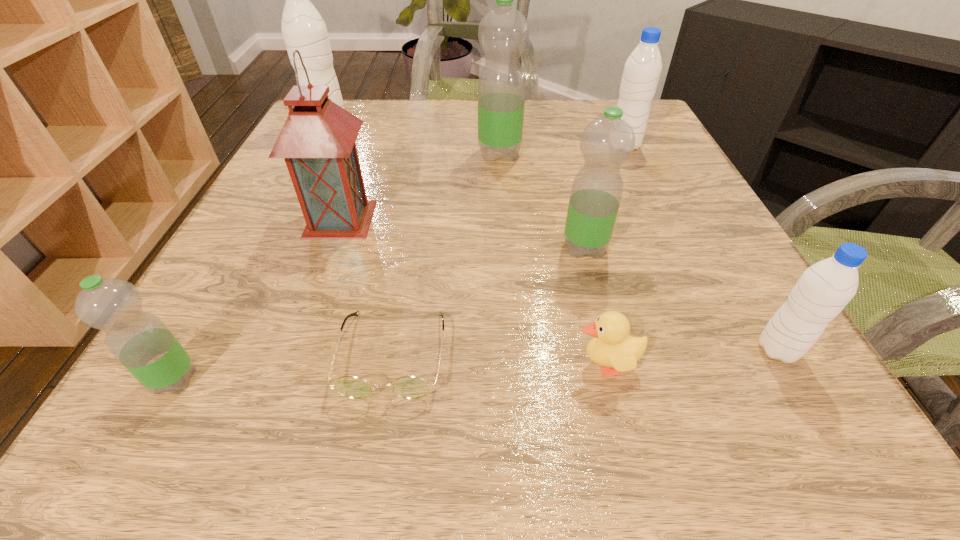
Where is `object that is the seventh closest one to the green spectacles`? object that is the seventh closest one to the green spectacles is located at coordinates (303, 28).

Image resolution: width=960 pixels, height=540 pixels. Find the location of `water bottle that is the fourth closest one to the sixth object from right to left`. water bottle that is the fourth closest one to the sixth object from right to left is located at coordinates (824, 289).

Image resolution: width=960 pixels, height=540 pixels. Identify the location of water bottle that is the closest to the smallest green water bottle. (607, 142).

Identify which green water bottle is located as the nearest to the duckling. Please provide its 2D coordinates. Your answer should be formatted as a tuple, i.e. [(x, y)], where the tuple contains the x and y coordinates of a point satisfying the conditions above.

[(607, 142)]

Choose which green water bottle is the second nearest neighbor to the second shortest object. Please provide its 2D coordinates. Your answer should be formatted as a tuple, i.e. [(x, y)], where the tuple contains the x and y coordinates of a point satisfying the conditions above.

[(503, 33)]

In order to click on the third closest gray water bottle to the leftmost green water bottle in this screenshot , I will do [x=642, y=70].

You are a GUI agent. You are given a task and a screenshot of the screen. Output one action in this format:
    pyautogui.click(x=<x>, y=<y>)
    Task: Click on the gray water bottle that is the closest to the third water bottle from right to left
    The image size is (960, 540).
    Given the screenshot: What is the action you would take?
    pyautogui.click(x=824, y=289)

This screenshot has height=540, width=960. Find the location of `free space that satisfies the following two spatial constraints: 1. on the front side of the lantern; 2. on the right side of the rightmost water bottle`. free space that satisfies the following two spatial constraints: 1. on the front side of the lantern; 2. on the right side of the rightmost water bottle is located at coordinates (293, 349).

Find the location of a particular element. free space that satisfies the following two spatial constraints: 1. on the front side of the second smallest green water bottle; 2. on the right side of the rightmost water bottle is located at coordinates (611, 349).